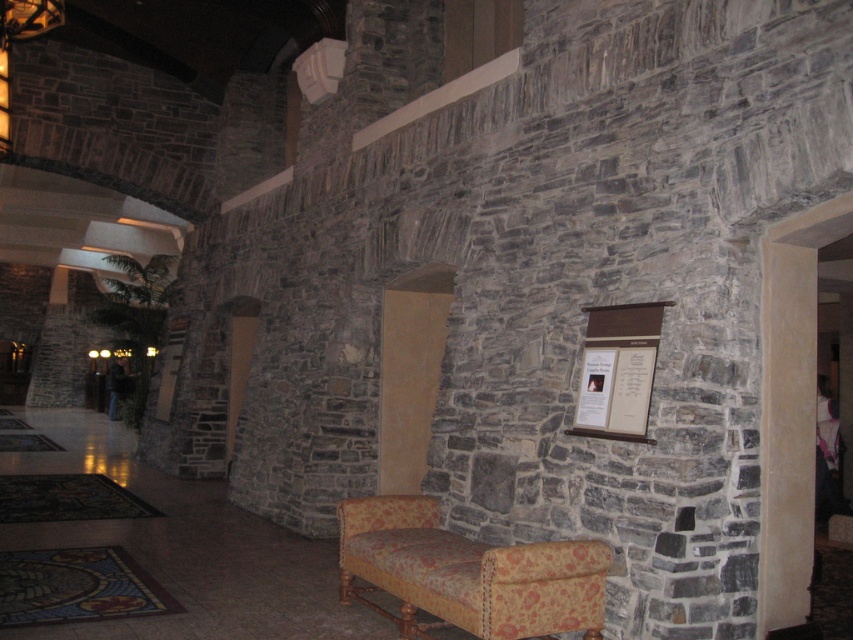
You are standing in the room and want to move from the stone wall to the bench. The points you need to pass through are point (511,560) and point (639,442). Which point should you reach first?

You should reach point (511,560) first because it is in front of point (639,442), meaning it is closer to your starting position at the stone wall.